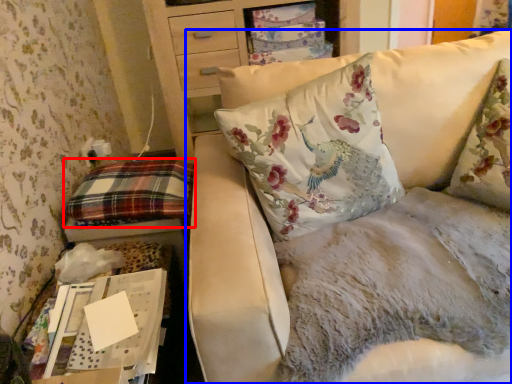
Question: Which of the following is the closest to the observer, pillow (highlighted by a red box) or studio couch (highlighted by a blue box)?

Choices:
 (A) pillow
 (B) studio couch

Answer: (B)